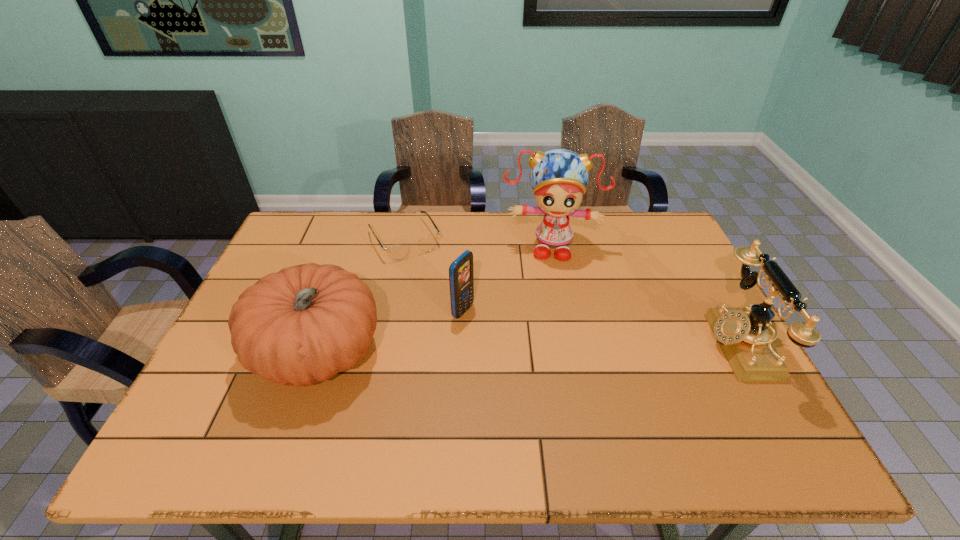
Where is `vacant space positioned on the screen of the third object from right to left`? The image size is (960, 540). vacant space positioned on the screen of the third object from right to left is located at coordinates (612, 388).

Image resolution: width=960 pixels, height=540 pixels. Find the location of `free point located on the screen of the third object from right to left`. free point located on the screen of the third object from right to left is located at coordinates (506, 335).

Identify the location of blank space located 0.120m on the screen of the third object from right to left. The image size is (960, 540). (510, 336).

Locate an element on the screen. vacant space positioned on the face of the doll is located at coordinates (546, 313).

Locate an element on the screen. Image resolution: width=960 pixels, height=540 pixels. vacant region located 0.150m on the face of the doll is located at coordinates (546, 298).

Identify the location of vacant region located on the face of the doll. (545, 324).

Locate an element on the screen. vacant position located on the front-facing side of the shortest object is located at coordinates (462, 334).

This screenshot has height=540, width=960. Find the location of `blank area located 0.400m on the front-facing side of the shortest object`. blank area located 0.400m on the front-facing side of the shortest object is located at coordinates (473, 353).

Where is `free space located 0.140m on the front-facing side of the shortest object`? free space located 0.140m on the front-facing side of the shortest object is located at coordinates (435, 289).

This screenshot has width=960, height=540. What are the coordinates of `doll present at the far edge` in the screenshot? It's located at (559, 177).